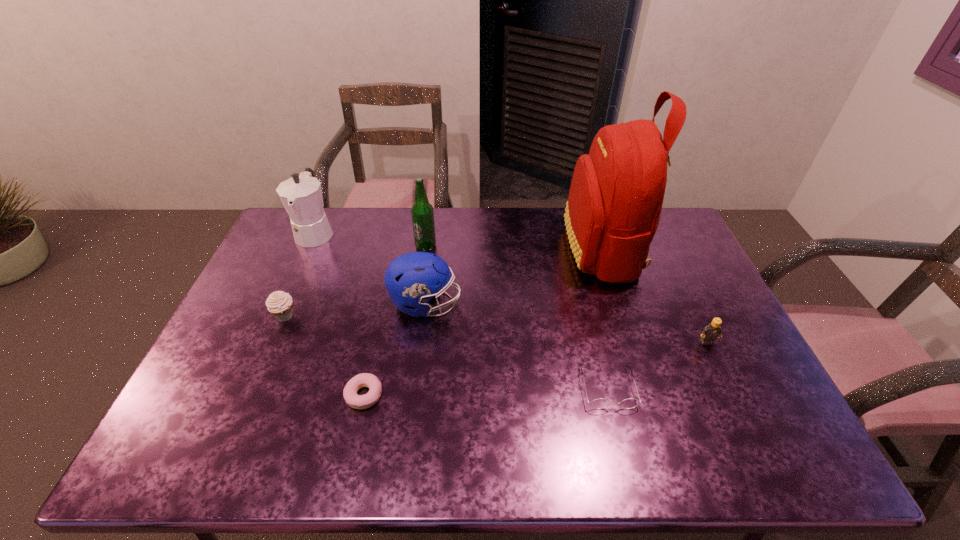
Where is `beer bottle located in the far edge section of the desktop`? This screenshot has width=960, height=540. beer bottle located in the far edge section of the desktop is located at coordinates click(422, 213).

Locate an element on the screen. The width and height of the screenshot is (960, 540). coffeepot that is positioned at the far edge is located at coordinates (301, 195).

You are a GUI agent. You are given a task and a screenshot of the screen. Output one action in this format:
    pyautogui.click(x=<x>, y=<y>)
    Task: Click on the coffeepot positioned at the left edge
    
    Given the screenshot: What is the action you would take?
    pyautogui.click(x=301, y=195)

Where is `muffin at the left edge`? The width and height of the screenshot is (960, 540). muffin at the left edge is located at coordinates (279, 303).

Find the location of `object that is at the right edge`. object that is at the right edge is located at coordinates (712, 330).

Where is `object that is at the far left corner`? The width and height of the screenshot is (960, 540). object that is at the far left corner is located at coordinates (301, 195).

I want to click on blank space at the far edge of the desktop, so click(531, 228).

Where is `free region at the near edge`? Image resolution: width=960 pixels, height=540 pixels. free region at the near edge is located at coordinates (422, 442).

In the image, there is a desktop. In order to click on vacant space at the left edge in this screenshot , I will do `click(256, 330)`.

Image resolution: width=960 pixels, height=540 pixels. I want to click on vacant position at the far right corner of the desktop, so (x=660, y=234).